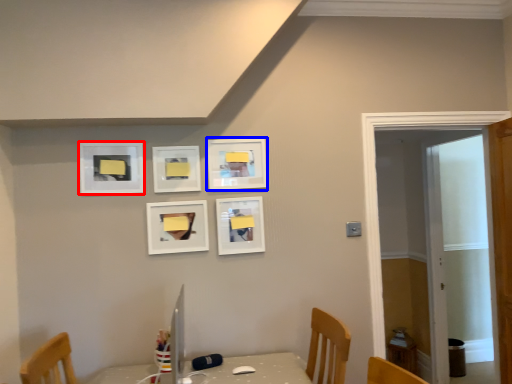
Question: Among these objects, which one is nearest to the camera, picture frame (highlighted by a red box) or picture frame (highlighted by a blue box)?

Choices:
 (A) picture frame
 (B) picture frame

Answer: (A)